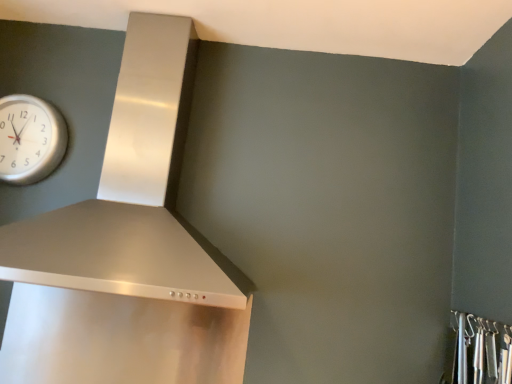
Question: In terms of width, does metallic silver hooks at lower right look wider or thinner when compared to satin silver vent at upper left?

Choices:
 (A) thin
 (B) wide

Answer: (A)

Question: Is point (506, 367) positioned closer to the camera than point (35, 218)?

Choices:
 (A) closer
 (B) farther

Answer: (A)

Question: Which is nearer to the silver metallic clock at upper left?

Choices:
 (A) metallic silver hooks at lower right
 (B) satin silver vent at upper left

Answer: (B)

Question: Which object is the closest to the satin silver vent at upper left?

Choices:
 (A) metallic silver hooks at lower right
 (B) silver metallic clock at upper left

Answer: (B)